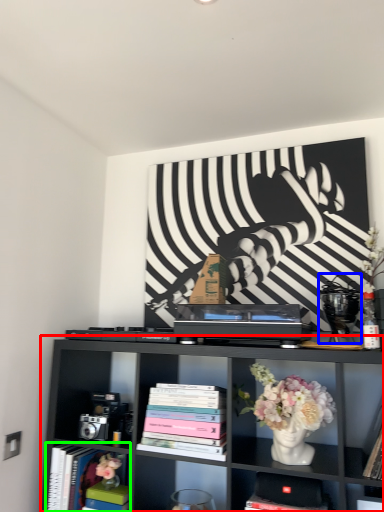
Question: Which object is positioned closest to shelf (highlighted by a red box)? Select from toy (highlighted by a blue box) and book (highlighted by a green box).

Choices:
 (A) toy
 (B) book

Answer: (B)